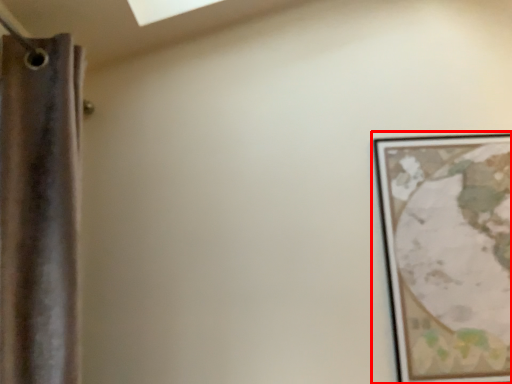
Question: Considering the relative positions of picture frame (annotated by the red box) and curtain in the image provided, where is picture frame (annotated by the red box) located with respect to the staircase?

Choices:
 (A) right
 (B) left

Answer: (A)